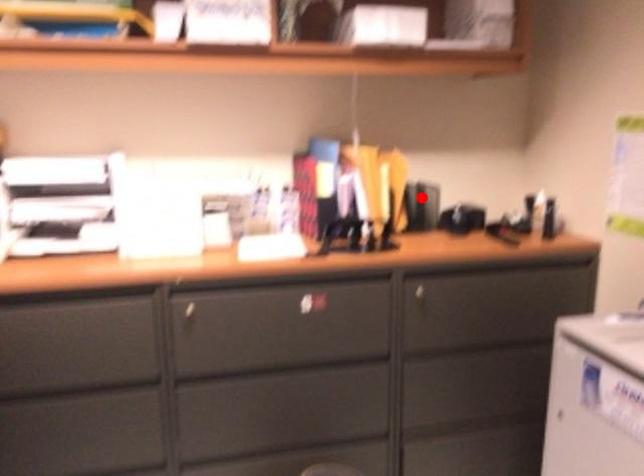
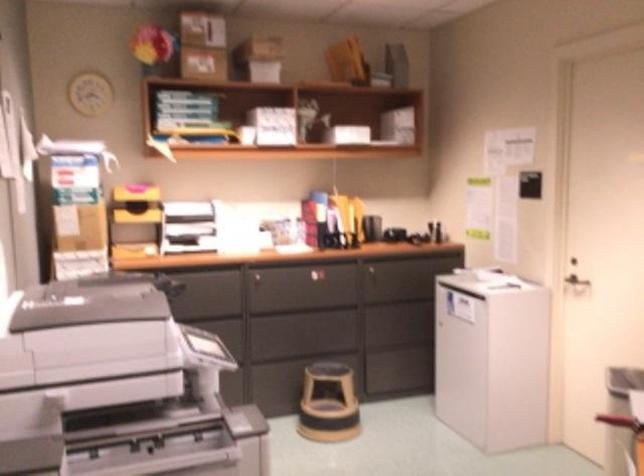
Question: I am providing you with two images of the same scene from different viewpoints. In image1, a red point is highlighted. Considering the same 3D point in image2, which of the following is correct?

Choices:
 (A) It is closer
 (B) It is farther

Answer: (B)